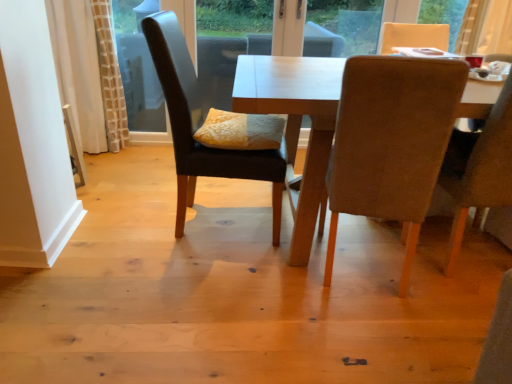
Question: Is yellow textured pillow at center shorter than beige fabric chair at right, positioned as the third chair in left-to-right order?

Choices:
 (A) yes
 (B) no

Answer: (A)

Question: Is yellow textured pillow at center at the right side of beige fabric chair at right, placed as the 1th chair when sorted from right to left?

Choices:
 (A) yes
 (B) no

Answer: (B)

Question: From a real-world perspective, is yellow textured pillow at center located beneath beige fabric chair at right, placed as the 1th chair when sorted from right to left?

Choices:
 (A) no
 (B) yes

Answer: (B)

Question: Can you confirm if yellow textured pillow at center is positioned to the left of beige fabric chair at right, placed as the 1th chair when sorted from right to left?

Choices:
 (A) yes
 (B) no

Answer: (A)

Question: Does yellow textured pillow at center have a greater width compared to beige fabric chair at right, positioned as the third chair in left-to-right order?

Choices:
 (A) no
 (B) yes

Answer: (A)

Question: Can beige fabric chair at right, placed as the 1th chair when sorted from right to left, be found inside yellow textured pillow at center?

Choices:
 (A) no
 (B) yes

Answer: (A)

Question: Is dark brown leather chair at center, which is counted as the 1th chair, starting from the left, oriented towards velvet beige chair at right, which is the 2th chair in right-to-left order?

Choices:
 (A) yes
 (B) no

Answer: (B)

Question: Considering the relative sizes of dark brown leather chair at center, which is counted as the 1th chair, starting from the left, and velvet beige chair at right, the 2th chair when ordered from left to right, in the image provided, is dark brown leather chair at center, which is counted as the 1th chair, starting from the left, bigger than velvet beige chair at right, the 2th chair when ordered from left to right,?

Choices:
 (A) yes
 (B) no

Answer: (A)

Question: Is dark brown leather chair at center, which is counted as the 1th chair, starting from the left, to the right of velvet beige chair at right, the 2th chair when ordered from left to right, from the viewer's perspective?

Choices:
 (A) yes
 (B) no

Answer: (B)

Question: Is dark brown leather chair at center, which appears as the 3th chair when viewed from the right, closer to the viewer compared to velvet beige chair at right, the 2th chair when ordered from left to right?

Choices:
 (A) yes
 (B) no

Answer: (B)

Question: From a real-world perspective, is dark brown leather chair at center, which is counted as the 1th chair, starting from the left, over velvet beige chair at right, which is the 2th chair in right-to-left order?

Choices:
 (A) yes
 (B) no

Answer: (A)

Question: Would you say dark brown leather chair at center, which is counted as the 1th chair, starting from the left, is outside velvet beige chair at right, which is the 2th chair in right-to-left order?

Choices:
 (A) yes
 (B) no

Answer: (A)

Question: Is light brown wooden table at center turned away from beige fabric chair at right, placed as the 1th chair when sorted from right to left?

Choices:
 (A) yes
 (B) no

Answer: (A)